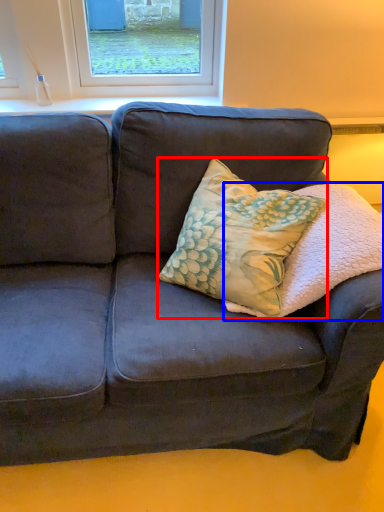
Question: Among these objects, which one is farthest to the camera, throw pillow (highlighted by a red box) or pillow (highlighted by a blue box)?

Choices:
 (A) throw pillow
 (B) pillow

Answer: (A)